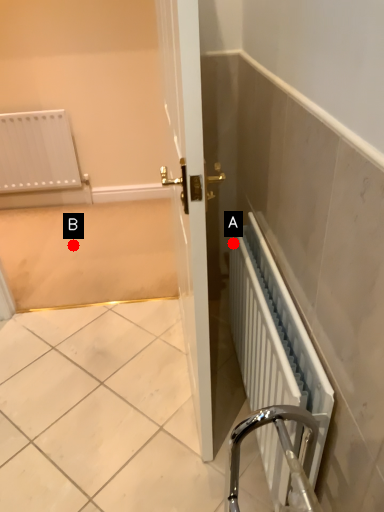
Question: Two points are circled on the image, labeled by A and B beside each circle. Which point is further to the camera?

Choices:
 (A) A is further
 (B) B is further

Answer: (B)